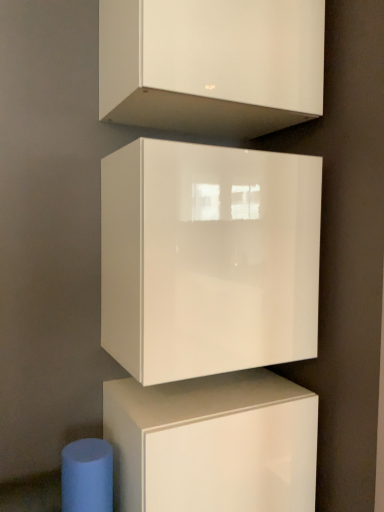
What is the approximate width of glossy white cabinet at center, acting as the 1th cabinetry starting from the bottom?

It is 16.74 inches.

You are a GUI agent. You are given a task and a screenshot of the screen. Output one action in this format:
    pyautogui.click(x=<x>, y=<y>)
    Task: Click on the white glossy cabinet at upper center, which appears as the 3th cabinetry when ordered from the bottom
    This screenshot has width=384, height=512.
    Given the screenshot: What is the action you would take?
    pyautogui.click(x=211, y=64)

How many degrees apart are the facing directions of glossy white cube at center, positioned as the 2th cabinetry in bottom-to-top order, and white glossy cabinet at upper center, the 1th cabinetry viewed from the top?

The angle between the facing direction of glossy white cube at center, positioned as the 2th cabinetry in bottom-to-top order, and the facing direction of white glossy cabinet at upper center, the 1th cabinetry viewed from the top, is 3.23e-05 degrees.

Can you confirm if glossy white cube at center, positioned as the 2th cabinetry in bottom-to-top order, is bigger than white glossy cabinet at upper center, which appears as the 3th cabinetry when ordered from the bottom?

Indeed, glossy white cube at center, positioned as the 2th cabinetry in bottom-to-top order, has a larger size compared to white glossy cabinet at upper center, which appears as the 3th cabinetry when ordered from the bottom.

Find the location of a particular element. cabinetry in front of the glossy white cube at center, which is the second cabinetry in top-to-bottom order is located at coordinates (211, 64).

Can you confirm if glossy white cube at center, which is the second cabinetry in top-to-bottom order, is positioned to the right of white glossy cabinet at upper center, which appears as the 3th cabinetry when ordered from the bottom?

No.

From the image's perspective, between white glossy cabinet at upper center, which appears as the 3th cabinetry when ordered from the bottom, and glossy white cabinet at center, acting as the 1th cabinetry starting from the bottom, who is located below?

glossy white cabinet at center, acting as the 1th cabinetry starting from the bottom, is shown below in the image.

Locate an element on the screen. This screenshot has height=512, width=384. the 2nd cabinetry to the left of the white glossy cabinet at upper center, the 1th cabinetry viewed from the top, counting from the anchor's position is located at coordinates (212, 443).

Would you say white glossy cabinet at upper center, which appears as the 3th cabinetry when ordered from the bottom, is to the left or to the right of glossy white cabinet at center, which appears as the 3th cabinetry when viewed from the top, in the picture?

Based on their positions, white glossy cabinet at upper center, which appears as the 3th cabinetry when ordered from the bottom, is located to the right of glossy white cabinet at center, which appears as the 3th cabinetry when viewed from the top.

Is glossy white cube at center, positioned as the 2th cabinetry in bottom-to-top order, at the left side of glossy white cabinet at center, acting as the 1th cabinetry starting from the bottom?

→ In fact, glossy white cube at center, positioned as the 2th cabinetry in bottom-to-top order, is to the right of glossy white cabinet at center, acting as the 1th cabinetry starting from the bottom.

Measure the distance from glossy white cube at center, positioned as the 2th cabinetry in bottom-to-top order, to glossy white cabinet at center, which appears as the 3th cabinetry when viewed from the top.

glossy white cube at center, positioned as the 2th cabinetry in bottom-to-top order, is 13.52 inches away from glossy white cabinet at center, which appears as the 3th cabinetry when viewed from the top.

Between glossy white cube at center, positioned as the 2th cabinetry in bottom-to-top order, and glossy white cabinet at center, acting as the 1th cabinetry starting from the bottom, which one has less height?

glossy white cabinet at center, acting as the 1th cabinetry starting from the bottom, is shorter.

From the image's perspective, does glossy white cube at center, which is the second cabinetry in top-to-bottom order, appear lower than glossy white cabinet at center, which appears as the 3th cabinetry when viewed from the top?

Actually, glossy white cube at center, which is the second cabinetry in top-to-bottom order, appears above glossy white cabinet at center, which appears as the 3th cabinetry when viewed from the top, in the image.

How different are the orientations of white glossy cabinet at upper center, the 1th cabinetry viewed from the top, and glossy white cube at center, which is the second cabinetry in top-to-bottom order, in degrees?

white glossy cabinet at upper center, the 1th cabinetry viewed from the top, and glossy white cube at center, which is the second cabinetry in top-to-bottom order, are facing 3.23e-05 degrees away from each other.

Considering the relative sizes of white glossy cabinet at upper center, which appears as the 3th cabinetry when ordered from the bottom, and glossy white cube at center, which is the second cabinetry in top-to-bottom order, in the image provided, is white glossy cabinet at upper center, which appears as the 3th cabinetry when ordered from the bottom, shorter than glossy white cube at center, which is the second cabinetry in top-to-bottom order,?

Yes, white glossy cabinet at upper center, which appears as the 3th cabinetry when ordered from the bottom, is shorter than glossy white cube at center, which is the second cabinetry in top-to-bottom order.

Is glossy white cube at center, which is the second cabinetry in top-to-bottom order, completely or partially inside white glossy cabinet at upper center, the 1th cabinetry viewed from the top?

Definitely not — glossy white cube at center, which is the second cabinetry in top-to-bottom order, is not inside white glossy cabinet at upper center, the 1th cabinetry viewed from the top.

Is white glossy cabinet at upper center, the 1th cabinetry viewed from the top, facing away from glossy white cube at center, which is the second cabinetry in top-to-bottom order?

No, white glossy cabinet at upper center, the 1th cabinetry viewed from the top,'s orientation is not away from glossy white cube at center, which is the second cabinetry in top-to-bottom order.

Which of these two, glossy white cabinet at center, which appears as the 3th cabinetry when viewed from the top, or glossy white cube at center, positioned as the 2th cabinetry in bottom-to-top order, is bigger?

glossy white cube at center, positioned as the 2th cabinetry in bottom-to-top order, is bigger.

Can you confirm if glossy white cabinet at center, which appears as the 3th cabinetry when viewed from the top, is positioned to the right of glossy white cube at center, which is the second cabinetry in top-to-bottom order?

Incorrect, glossy white cabinet at center, which appears as the 3th cabinetry when viewed from the top, is not on the right side of glossy white cube at center, which is the second cabinetry in top-to-bottom order.

Can you confirm if glossy white cabinet at center, acting as the 1th cabinetry starting from the bottom, is shorter than glossy white cube at center, positioned as the 2th cabinetry in bottom-to-top order?

Yes.

Is glossy white cube at center, which is the second cabinetry in top-to-bottom order, at the back of glossy white cabinet at center, which appears as the 3th cabinetry when viewed from the top?

No, glossy white cube at center, which is the second cabinetry in top-to-bottom order, is not at the back of glossy white cabinet at center, which appears as the 3th cabinetry when viewed from the top.

Considering the relative sizes of glossy white cabinet at center, which appears as the 3th cabinetry when viewed from the top, and white glossy cabinet at upper center, which appears as the 3th cabinetry when ordered from the bottom, in the image provided, is glossy white cabinet at center, which appears as the 3th cabinetry when viewed from the top, thinner than white glossy cabinet at upper center, which appears as the 3th cabinetry when ordered from the bottom,?

Incorrect, the width of glossy white cabinet at center, which appears as the 3th cabinetry when viewed from the top, is not less than that of white glossy cabinet at upper center, which appears as the 3th cabinetry when ordered from the bottom.

Is glossy white cabinet at center, which appears as the 3th cabinetry when viewed from the top, inside or outside of white glossy cabinet at upper center, which appears as the 3th cabinetry when ordered from the bottom?

glossy white cabinet at center, which appears as the 3th cabinetry when viewed from the top, is not enclosed by white glossy cabinet at upper center, which appears as the 3th cabinetry when ordered from the bottom.

Which of these two, glossy white cabinet at center, acting as the 1th cabinetry starting from the bottom, or white glossy cabinet at upper center, which appears as the 3th cabinetry when ordered from the bottom, is bigger?

Bigger between the two is glossy white cabinet at center, acting as the 1th cabinetry starting from the bottom.

Is glossy white cabinet at center, acting as the 1th cabinetry starting from the bottom, to the right of white glossy cabinet at upper center, the 1th cabinetry viewed from the top, from the viewer's perspective?

No.

Where is `cabinetry in front of the glossy white cube at center, positioned as the 2th cabinetry in bottom-to-top order`? This screenshot has height=512, width=384. cabinetry in front of the glossy white cube at center, positioned as the 2th cabinetry in bottom-to-top order is located at coordinates 211,64.

The height and width of the screenshot is (512, 384). In order to click on cabinetry that is the 2nd one below the white glossy cabinet at upper center, which appears as the 3th cabinetry when ordered from the bottom (from a real-world perspective) in this screenshot , I will do `click(212, 443)`.

Which object lies nearer to the anchor point glossy white cabinet at center, acting as the 1th cabinetry starting from the bottom, white glossy cabinet at upper center, which appears as the 3th cabinetry when ordered from the bottom, or glossy white cube at center, which is the second cabinetry in top-to-bottom order?

glossy white cube at center, which is the second cabinetry in top-to-bottom order, is closer to glossy white cabinet at center, acting as the 1th cabinetry starting from the bottom.

From the image, which object appears to be nearer to glossy white cube at center, which is the second cabinetry in top-to-bottom order, white glossy cabinet at upper center, which appears as the 3th cabinetry when ordered from the bottom, or glossy white cabinet at center, acting as the 1th cabinetry starting from the bottom?

Based on the image, glossy white cabinet at center, acting as the 1th cabinetry starting from the bottom, appears to be nearer to glossy white cube at center, which is the second cabinetry in top-to-bottom order.

When comparing their distances from white glossy cabinet at upper center, which appears as the 3th cabinetry when ordered from the bottom, does glossy white cube at center, which is the second cabinetry in top-to-bottom order, or glossy white cabinet at center, acting as the 1th cabinetry starting from the bottom, seem closer?

glossy white cube at center, which is the second cabinetry in top-to-bottom order.

Which object lies further to the anchor point white glossy cabinet at upper center, which appears as the 3th cabinetry when ordered from the bottom, glossy white cabinet at center, acting as the 1th cabinetry starting from the bottom, or glossy white cube at center, positioned as the 2th cabinetry in bottom-to-top order?

glossy white cabinet at center, acting as the 1th cabinetry starting from the bottom.

Which object lies nearer to the anchor point glossy white cabinet at center, which appears as the 3th cabinetry when viewed from the top, glossy white cube at center, which is the second cabinetry in top-to-bottom order, or white glossy cabinet at upper center, which appears as the 3th cabinetry when ordered from the bottom?

Among the two, glossy white cube at center, which is the second cabinetry in top-to-bottom order, is located nearer to glossy white cabinet at center, which appears as the 3th cabinetry when viewed from the top.

Which object lies nearer to the anchor point glossy white cube at center, positioned as the 2th cabinetry in bottom-to-top order, glossy white cabinet at center, acting as the 1th cabinetry starting from the bottom, or white glossy cabinet at upper center, the 1th cabinetry viewed from the top?

Among the two, glossy white cabinet at center, acting as the 1th cabinetry starting from the bottom, is located nearer to glossy white cube at center, positioned as the 2th cabinetry in bottom-to-top order.

I want to click on cabinetry between white glossy cabinet at upper center, the 1th cabinetry viewed from the top, and glossy white cabinet at center, which appears as the 3th cabinetry when viewed from the top, in the up-down direction, so click(x=208, y=259).